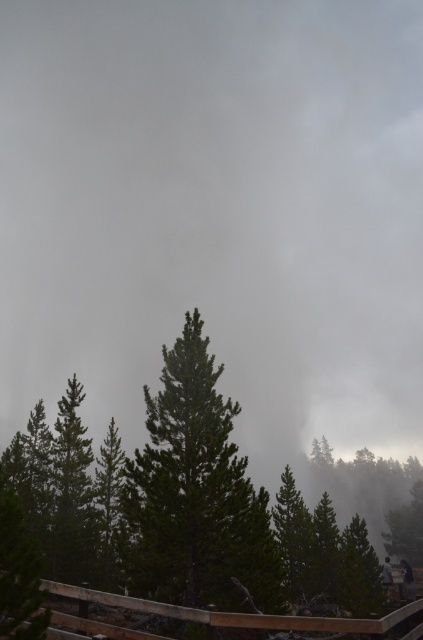
Which is behind, point (87, 596) or point (387, 596)?

The point (387, 596) is more distant.

Can you confirm if brown wooden rail at bottom is taller than white snowboarder at lower right?

Correct, brown wooden rail at bottom is much taller as white snowboarder at lower right.

Which is behind, point (401, 618) or point (384, 561)?

Point (384, 561)

Where is `brown wooden rail at bottom`? This screenshot has width=423, height=640. brown wooden rail at bottom is located at coordinates (236, 612).

Which is in front, point (151, 490) or point (386, 576)?

Point (151, 490) is in front.

Can you confirm if green matte tree at center is wider than white snowboarder at lower right?

Yes.

Between point (151, 396) and point (387, 563), which one is positioned behind?

Positioned behind is point (387, 563).

The width and height of the screenshot is (423, 640). In order to click on green matte tree at center in this screenshot , I will do `click(195, 492)`.

Based on the photo, does green matte tree at center have a lesser height compared to brown wooden rail at bottom?

In fact, green matte tree at center may be taller than brown wooden rail at bottom.

Is green matte tree at center taller than brown wooden rail at bottom?

Yes, green matte tree at center is taller than brown wooden rail at bottom.

Does point (184, 400) come behind point (214, 625)?

That is True.

This screenshot has height=640, width=423. I want to click on green matte tree at center, so click(x=195, y=492).